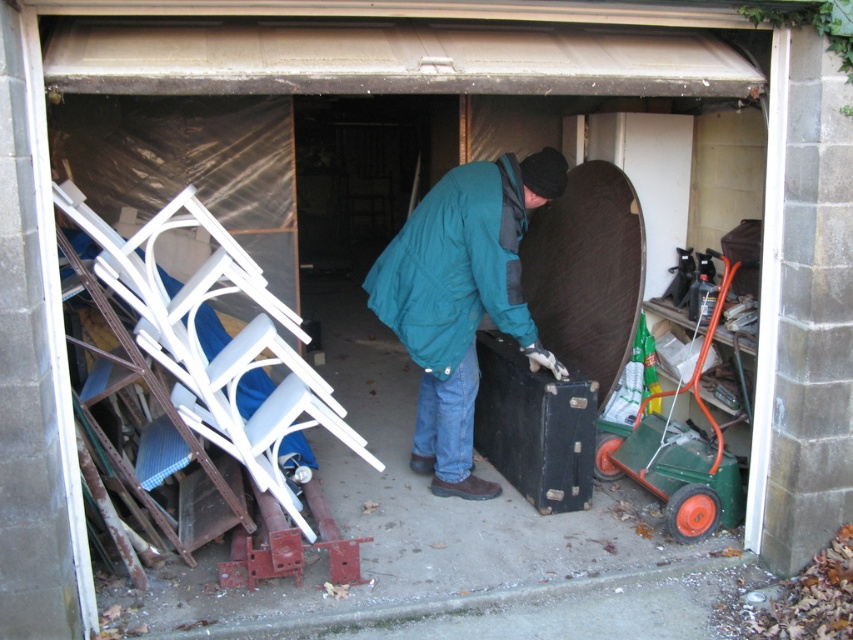
You are moving items in the garage and need to decide which item takes up more horizontal space. Which object is wider between the teal fabric jacket at center and the green plastic cart at right?

The teal fabric jacket at center is wider than the green plastic cart at right according to the description provided.

You are trying to locate the green plastic cart at right in the garage. According to the scene, where would you find it in relation to the teal fabric jacket at center?

The green plastic cart at right is underneath the teal fabric jacket at center because the teal fabric jacket at center is positioned over the green plastic cart at right.